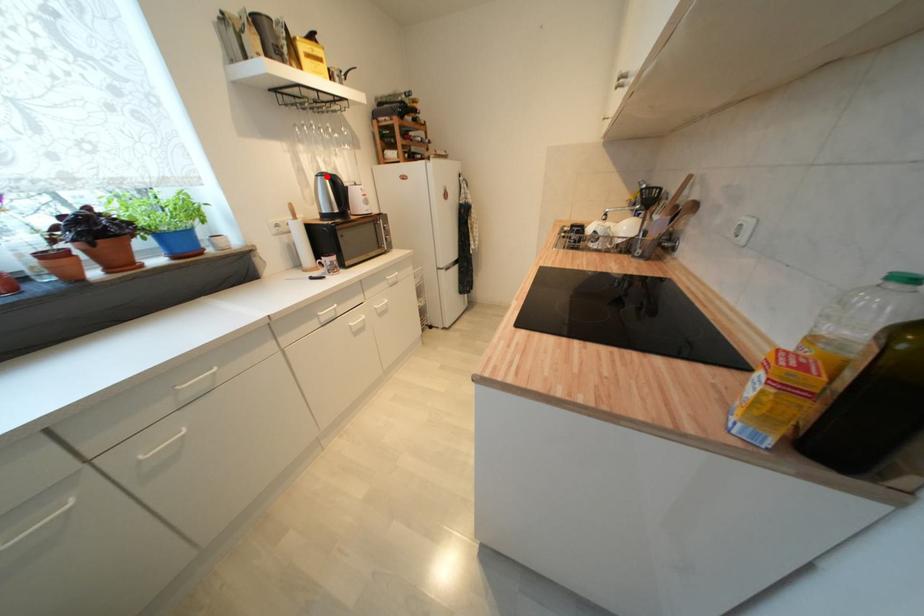
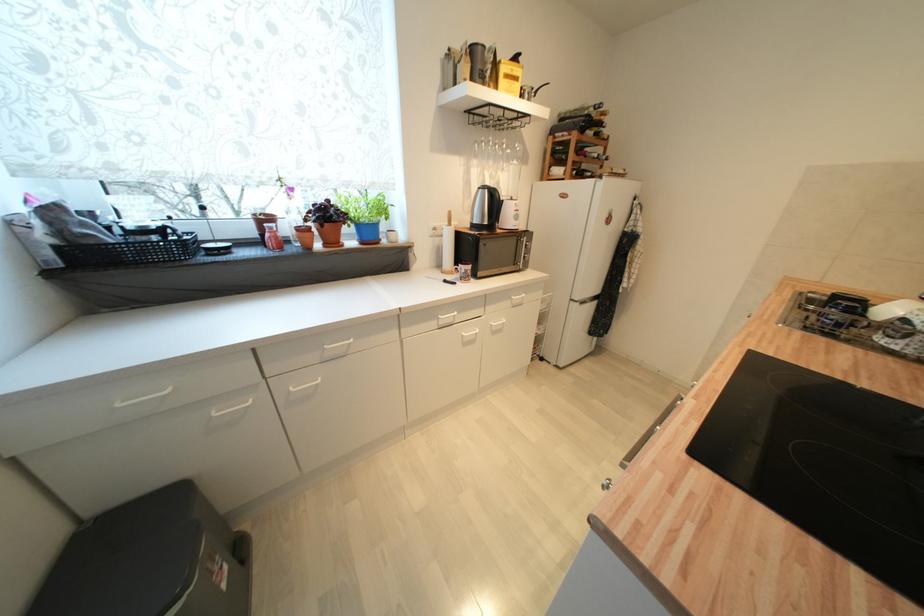
The point at the highlighted location is marked in the first image. Where is the corresponding point in the second image?

(489, 188)